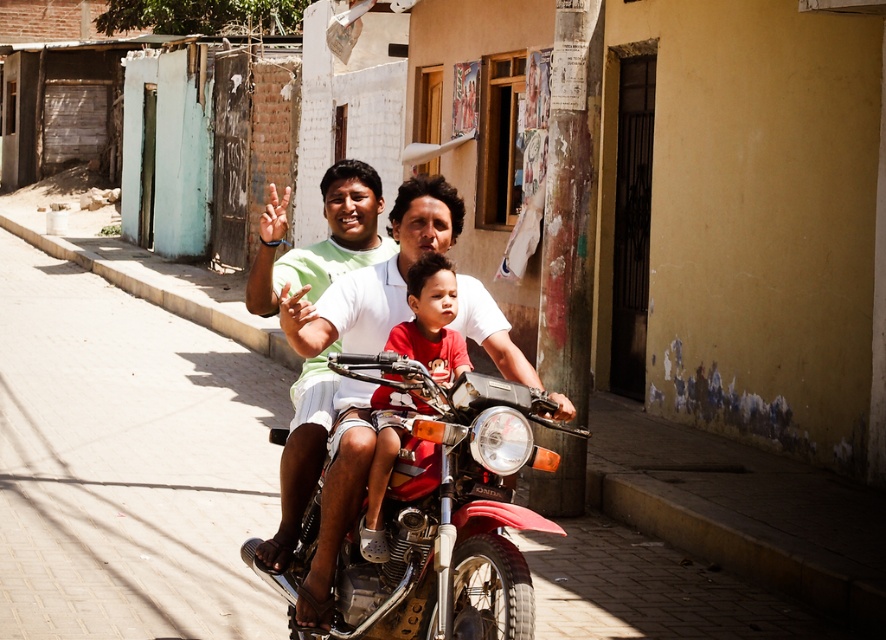
Between point (311, 456) and point (385, 486), which one is positioned in front?

Point (385, 486) is more forward.

Does green matte shirt at center have a smaller size compared to red cotton shirt at center?

Incorrect, green matte shirt at center is not smaller in size than red cotton shirt at center.

Locate an element on the screen. The height and width of the screenshot is (640, 886). green matte shirt at center is located at coordinates click(x=321, y=241).

Does point (468, 525) come farther from viewer compared to point (453, 272)?

No.

Is metallic red motorcycle at center to the right of red cotton shirt at center from the viewer's perspective?

No, metallic red motorcycle at center is not to the right of red cotton shirt at center.

Locate an element on the screen. Image resolution: width=886 pixels, height=640 pixels. metallic red motorcycle at center is located at coordinates (445, 497).

What are the coordinates of `metallic red motorcycle at center` in the screenshot? It's located at 445,497.

In the scene shown: Who is taller, metallic red motorcycle at center or green matte shirt at center?

metallic red motorcycle at center

Is metallic red motorcycle at center closer to the viewer compared to green matte shirt at center?

Yes, metallic red motorcycle at center is in front of green matte shirt at center.

The height and width of the screenshot is (640, 886). What do you see at coordinates (445, 497) in the screenshot?
I see `metallic red motorcycle at center` at bounding box center [445, 497].

Where is `metallic red motorcycle at center`? The height and width of the screenshot is (640, 886). metallic red motorcycle at center is located at coordinates (445, 497).